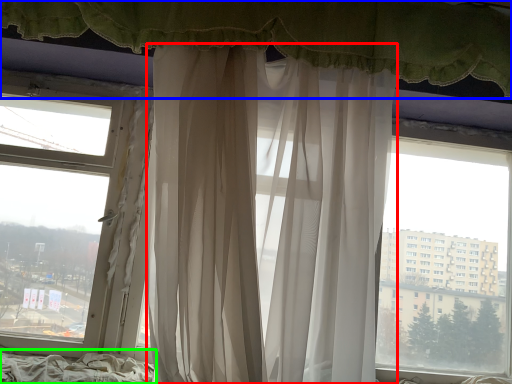
Question: Which is farther away from curtain (highlighted by a red box)? curtain (highlighted by a blue box) or bed frame (highlighted by a green box)?

Choices:
 (A) curtain
 (B) bed frame

Answer: (B)